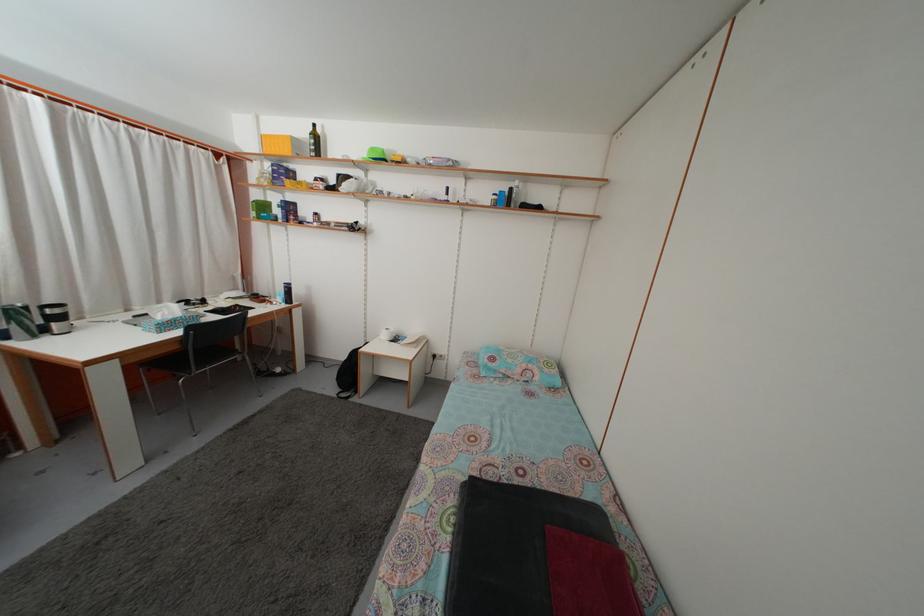
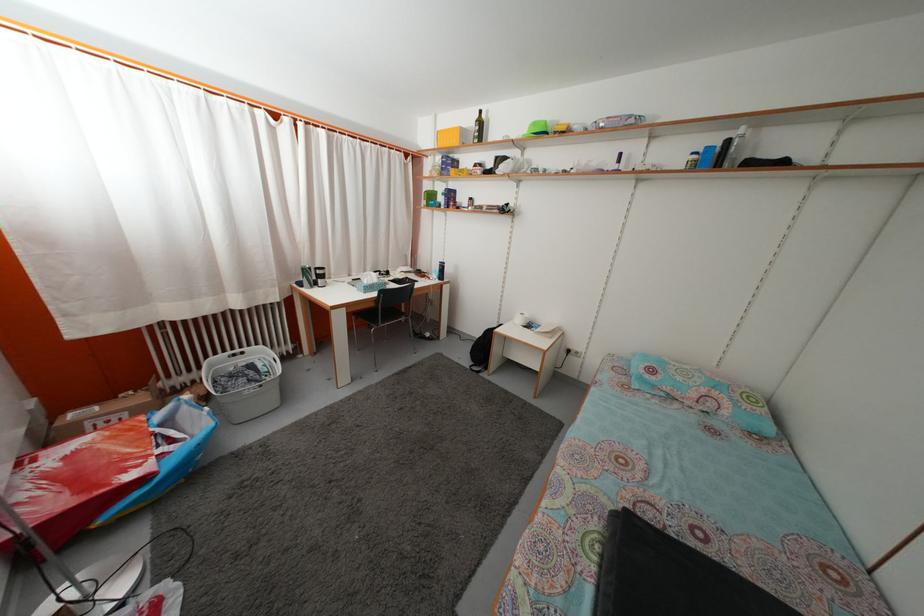
Where in the second image is the point corresponding to pixel 347 365 from the first image?

(482, 342)